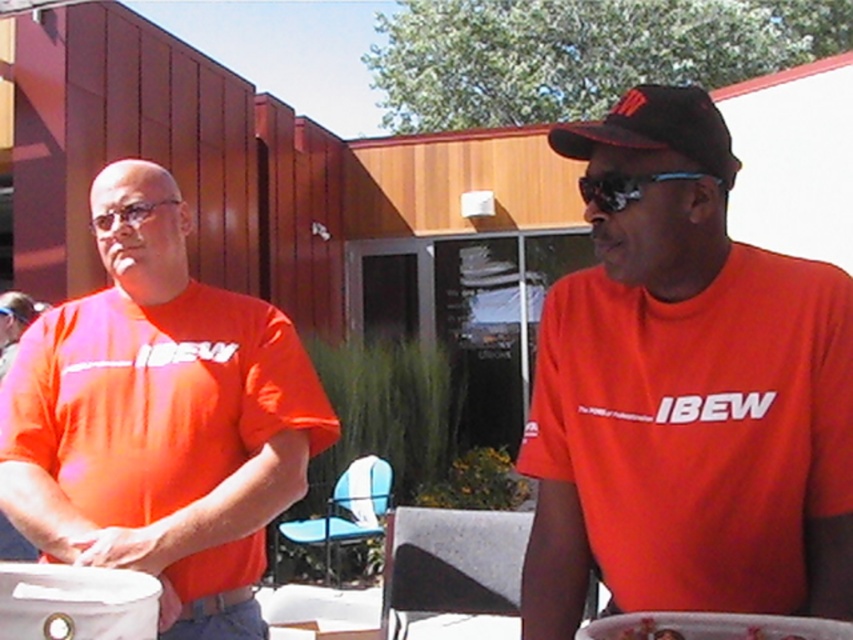
Question: Which point is farther to the camera?

Choices:
 (A) matte white platter at center
 (B) black fabric baseball cap at upper right
 (C) orange matte t-shirt at left
 (D) sunglasses at center

Answer: (C)

Question: Does black fabric baseball cap at upper right appear over matte white platter at center?

Choices:
 (A) yes
 (B) no

Answer: (A)

Question: Is orange matte t-shirt at center above matte white platter at center?

Choices:
 (A) no
 (B) yes

Answer: (B)

Question: Based on their relative distances, which object is farther from the matte white platter at center?

Choices:
 (A) orange matte t-shirt at left
 (B) sunglasses at center

Answer: (A)

Question: Among these points, which one is nearest to the camera?

Choices:
 (A) (656, 173)
 (B) (686, 125)

Answer: (A)

Question: Where is orange matte t-shirt at left located in relation to matte white platter at center in the image?

Choices:
 (A) above
 (B) below

Answer: (A)